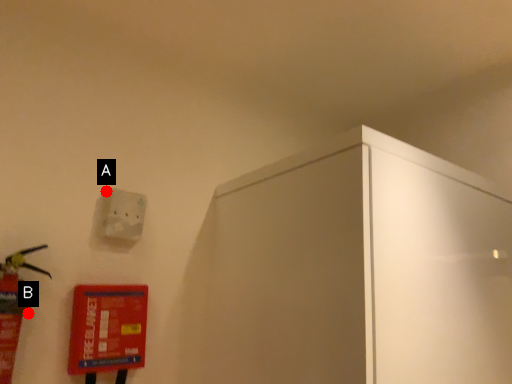
Question: Two points are circled on the image, labeled by A and B beside each circle. Which of the following is the farthest from the observer?

Choices:
 (A) A is further
 (B) B is further

Answer: (A)